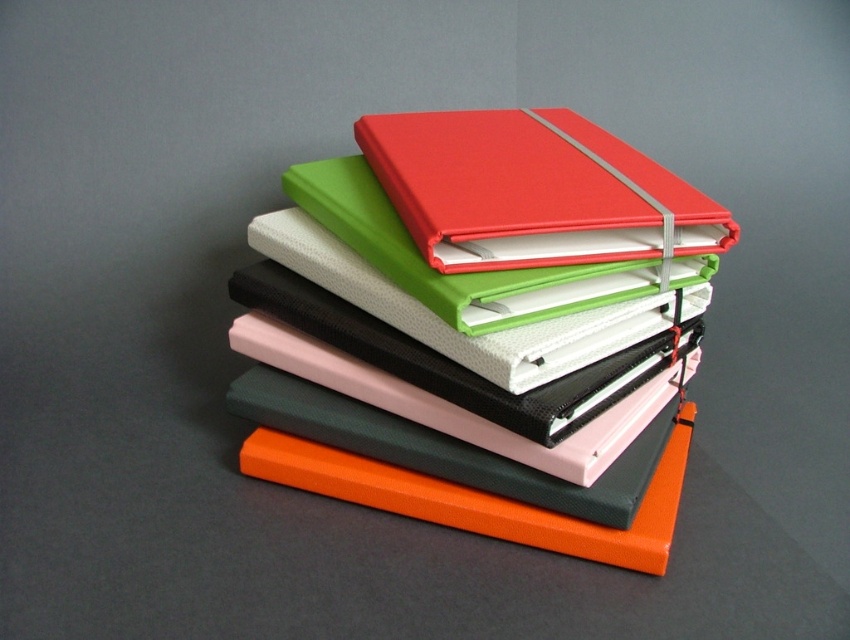
Question: Does matte red binder at upper center appear on the right side of orange matte binder at center?

Choices:
 (A) yes
 (B) no

Answer: (A)

Question: Does matte red binder at center have a smaller size compared to orange matte binder at center?

Choices:
 (A) yes
 (B) no

Answer: (B)

Question: Is matte red binder at center closer to the viewer compared to orange matte binder at center?

Choices:
 (A) yes
 (B) no

Answer: (A)

Question: Which point is farther to the camera?

Choices:
 (A) (380, 410)
 (B) (590, 236)

Answer: (A)

Question: Which of the following is the farthest from the observer?

Choices:
 (A) [x=578, y=252]
 (B) [x=389, y=234]

Answer: (B)

Question: Which object is farther from the camera taking this photo?

Choices:
 (A) matte red binder at center
 (B) orange matte binder at center
 (C) matte red binder at upper center

Answer: (B)